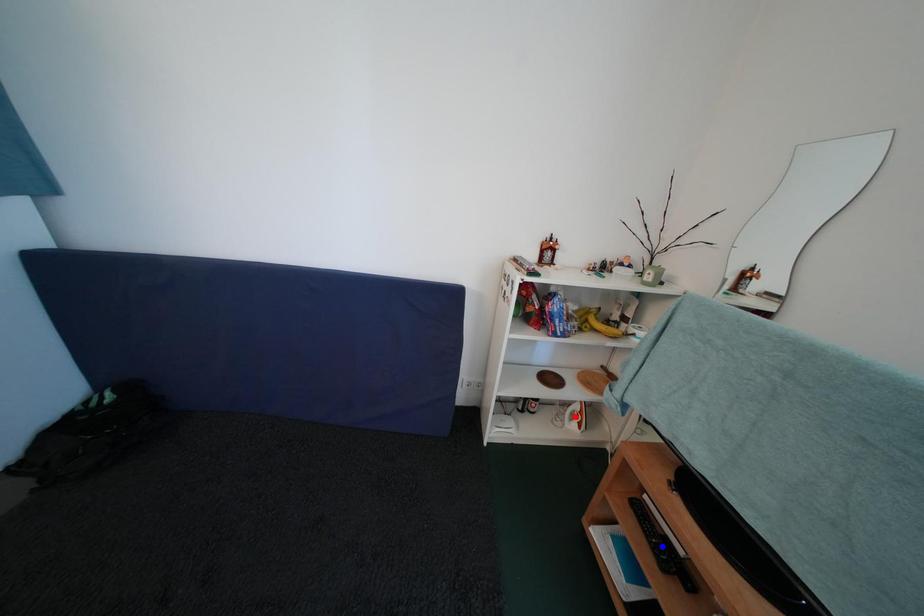
Question: Two points are marked on the image. Which point is closer to the camera?

Choices:
 (A) Blue point is closer.
 (B) Red point is closer.

Answer: (A)